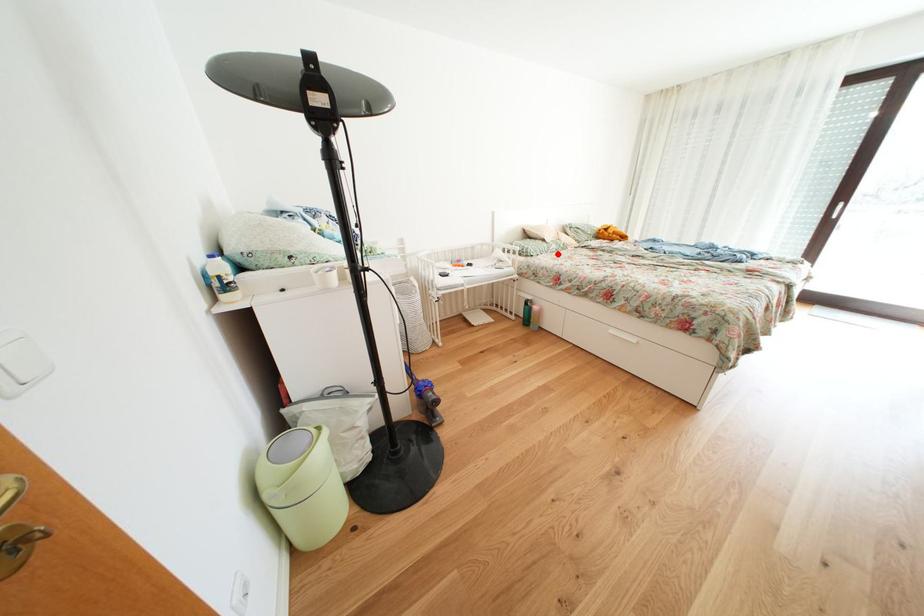
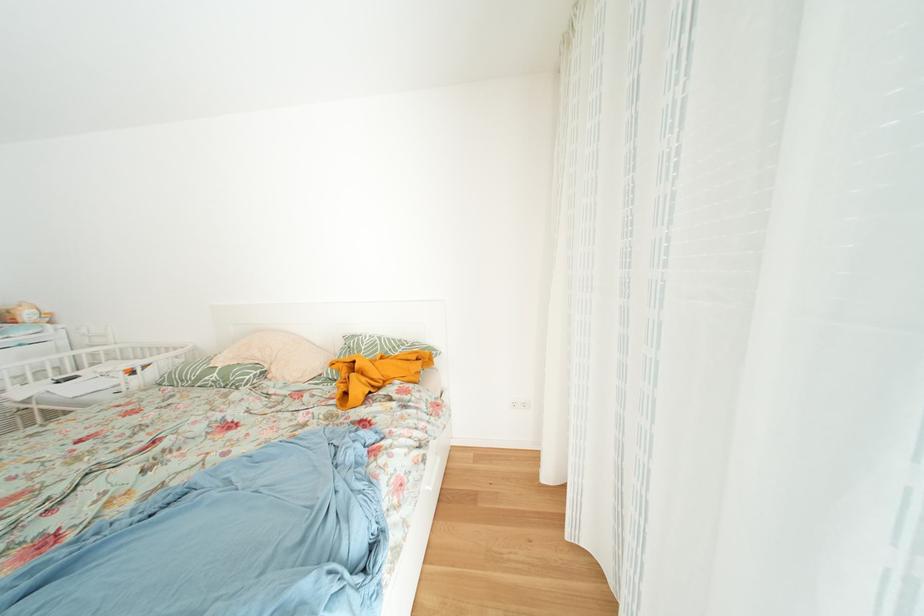
The point at the highlighted location is marked in the first image. Where is the corresponding point in the second image?

(208, 384)